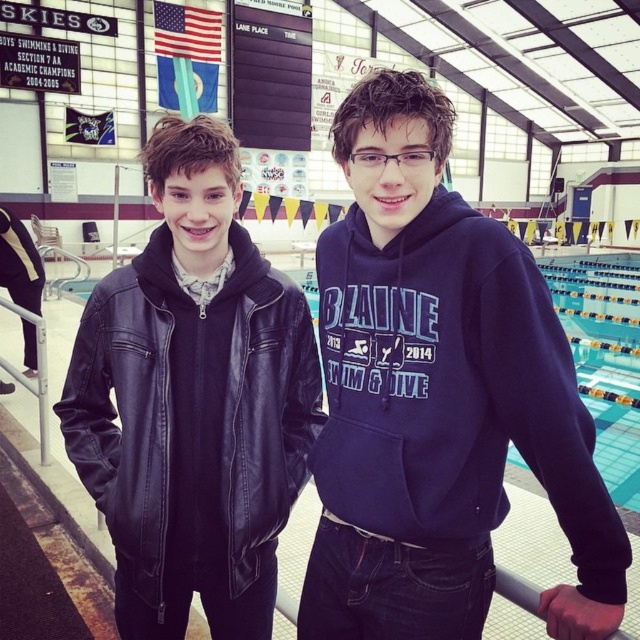
You are organizing a school event and need to arrange the two people in the image so that the navy blue hoodie at center is to the left of the leather jacket at left. Is this possible based on their current positions?

The navy blue hoodie at center is currently positioned on the right side of the leather jacket at left, so to place the navy blue hoodie at center to the left of the leather jacket at left would require moving them, which isn t possible without changing their current positions.

You are standing in the gymnasium and want to reach the white metallic rail at left without passing through the navy blue hoodie at center. Is it possible?

The navy blue hoodie at center is closer to the viewer than the white metallic rail at left, so you cannot reach the white metallic rail at left without moving past the navy blue hoodie at center.

You are trying to decide which person to approach for directions. The navy blue hoodie at center and the leather jacket at left are both facing you. Based on their heights, which one might you look up to when speaking to them?

The leather jacket at left is taller than the navy blue hoodie at center, so you would need to look up to speak to the person wearing the leather jacket at left.